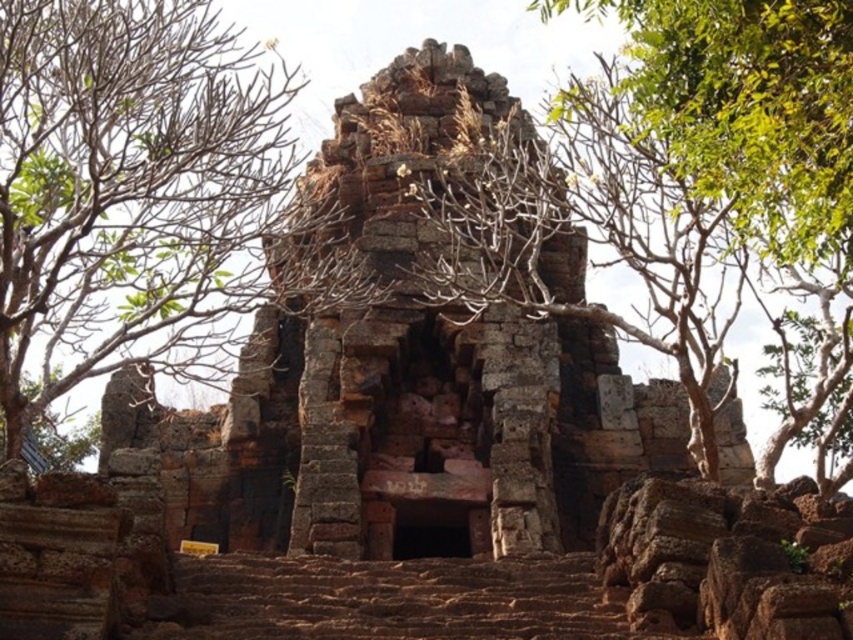
Consider the image. You are standing in front of an ancient stone temple with two marked points on its structure. The first point is at coordinate (61, 388) and the second at (778, 220). Which point would appear closer to your eyes when looking at the temple?

Point (61, 388) is further to the camera than point (778, 220), so the second point at (778, 220) would appear closer to your eyes.

You are standing in front of the ancient stone structure and want to take a photo of the central doorway. Which of the two green leafy trees, the green leafy tree at left or the green leafy tree at upper center, is positioned to the left of the other?

The green leafy tree at left is to the left of the green leafy tree at upper center.

You are standing in front of the ancient stone structure and notice a point marked at coordinates (131,192). Based on the scene description, what does this point most likely represent?

The point at (131,192) most likely represents the location of the green leafy tree at left as described in the scene.